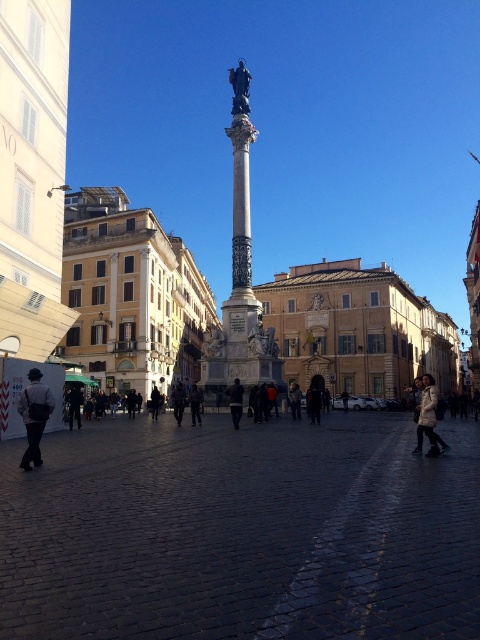
Question: Which object is the closest to the dark gray jacket at lower left?

Choices:
 (A) black fabric person at center
 (B) dark gray jacket at center

Answer: (A)

Question: Does dark cobblestone plaza at center have a greater width compared to dark gray jacket at center?

Choices:
 (A) yes
 (B) no

Answer: (A)

Question: Can you confirm if white textured coat at lower right is wider than dark gray wool coat at center?

Choices:
 (A) yes
 (B) no

Answer: (A)

Question: Which of these objects is positioned closest to the dark gray jacket at center?

Choices:
 (A) white textured coat at lower right
 (B) dark gray fabric jacket at lower left
 (C) dark gray wool coat at center

Answer: (C)

Question: Based on their relative distances, which object is farther from the dark brown leather jacket at center?

Choices:
 (A) dark cobblestone plaza at center
 (B) dark gray jacket at lower left

Answer: (A)

Question: Is dark cobblestone plaza at center in front of dark brown leather jacket at center?

Choices:
 (A) no
 (B) yes

Answer: (B)